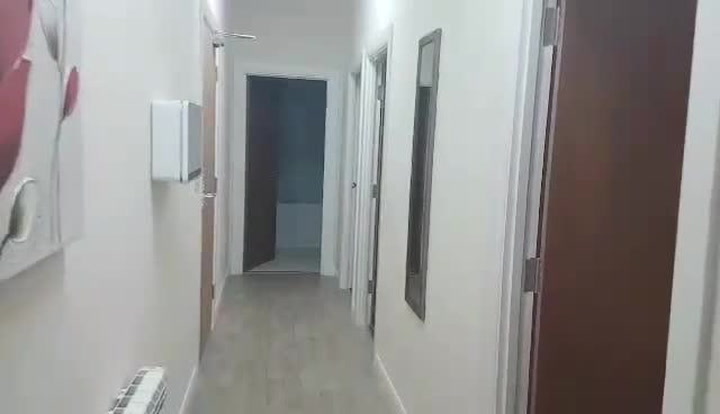
Find the location of a particular element. The height and width of the screenshot is (414, 720). white wall is located at coordinates (148, 299), (108, 65), (310, 38), (386, 23), (492, 52), (450, 294).